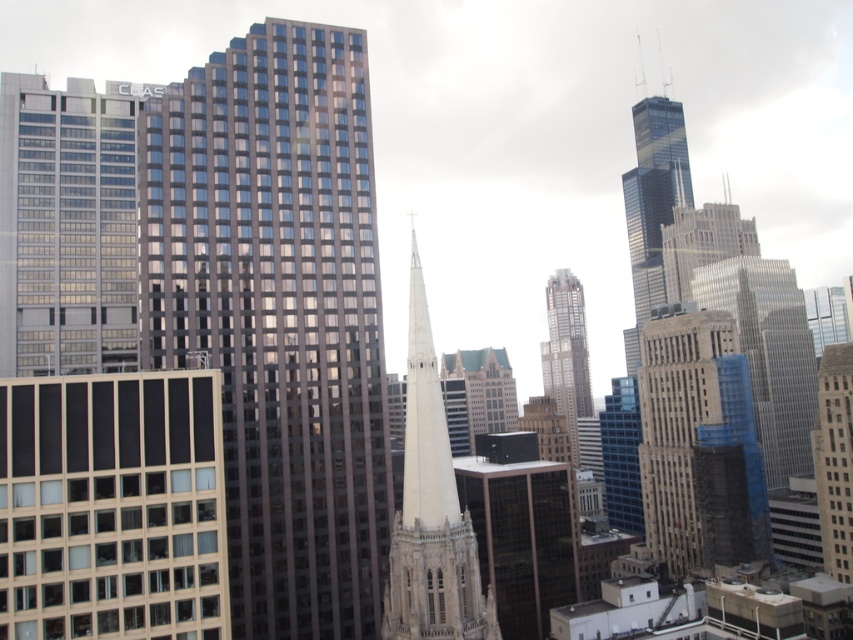
Question: Which point appears closest to the camera in this image?

Choices:
 (A) (44, 320)
 (B) (450, 499)

Answer: (B)

Question: Which object is positioned farthest from the dark glass skyscraper at center?

Choices:
 (A) brown stone tower at right
 (B) white stone spire at center
 (C) brown brick building at center-right

Answer: (A)

Question: Is glassy steel skyscraper at center to the left of beige glass building at center-left from the viewer's perspective?

Choices:
 (A) no
 (B) yes

Answer: (A)

Question: Does beige glass building at center-left have a greater width compared to matte glass building at left?

Choices:
 (A) yes
 (B) no

Answer: (B)

Question: Can you confirm if glassy steel skyscraper at center is wider than green glass tower at center?

Choices:
 (A) no
 (B) yes

Answer: (B)

Question: Estimate the real-world distances between objects in this image. Which object is closer to the brown brick building at center-right?

Choices:
 (A) brown stone tower at right
 (B) white stone spire at center

Answer: (A)